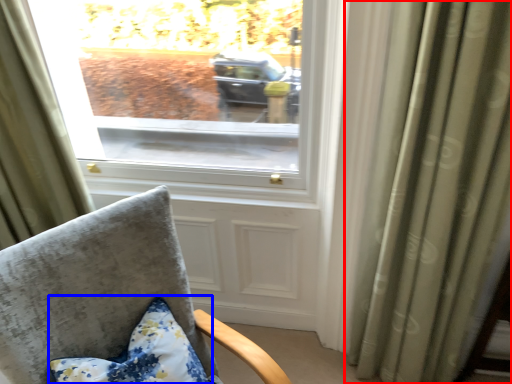
Question: Which object appears closest to the camera in this image, curtain (highlighted by a red box) or pillow (highlighted by a blue box)?

Choices:
 (A) curtain
 (B) pillow

Answer: (A)